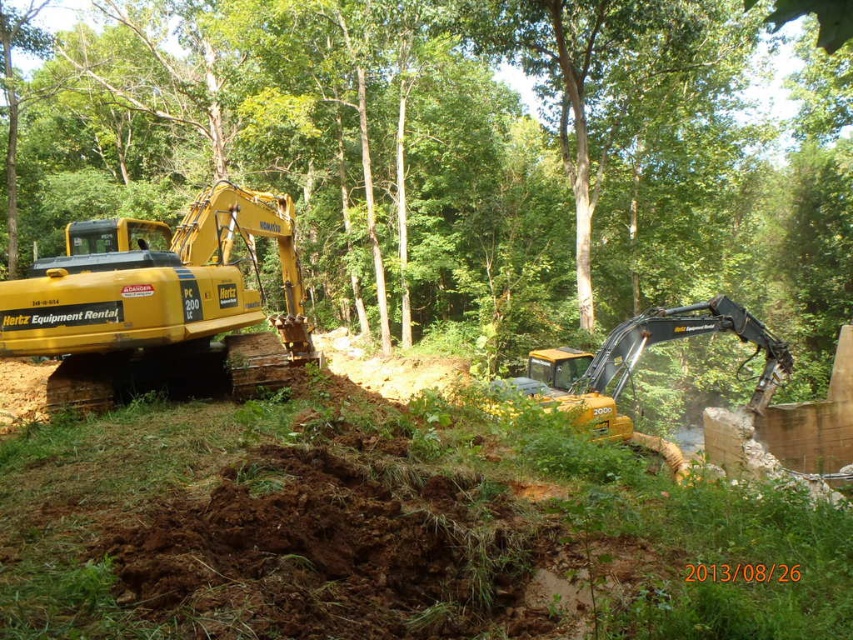
Question: Which point appears closest to the camera in this image?

Choices:
 (A) (190, 324)
 (B) (637, 320)

Answer: (A)

Question: Which point is closer to the camera?

Choices:
 (A) (700, 324)
 (B) (560, 67)
 (C) (125, 288)

Answer: (C)

Question: Is yellow metallic excavator at left smaller than yellow rubber excavator at center?

Choices:
 (A) yes
 (B) no

Answer: (B)

Question: Does yellow metallic excavator at left come behind yellow rubber excavator at center?

Choices:
 (A) yes
 (B) no

Answer: (B)

Question: Does yellow metallic excavator at left appear under yellow rubber excavator at center?

Choices:
 (A) no
 (B) yes

Answer: (A)

Question: Which object is positioned closest to the yellow rubber excavator at center?

Choices:
 (A) green leafy tree at upper center
 (B) yellow metallic excavator at left

Answer: (B)